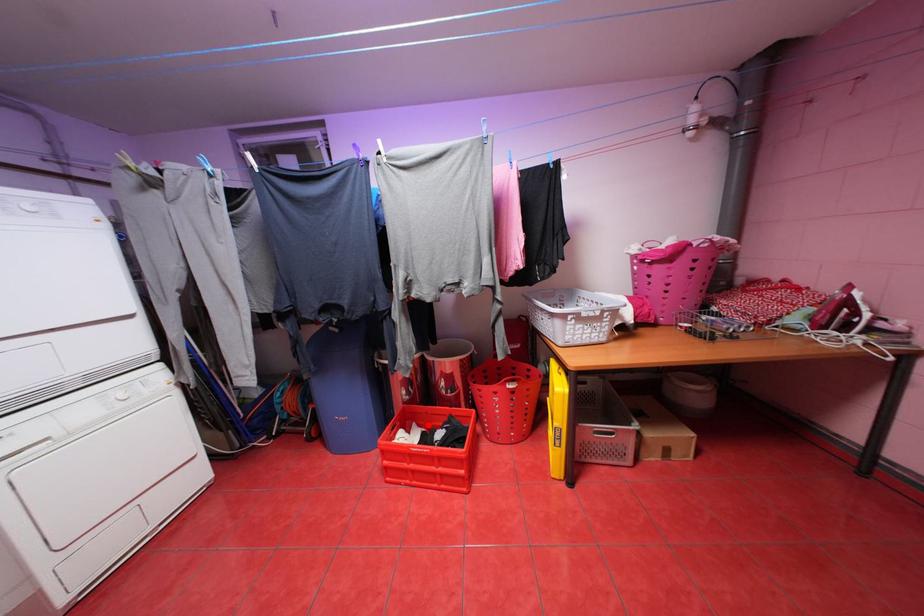
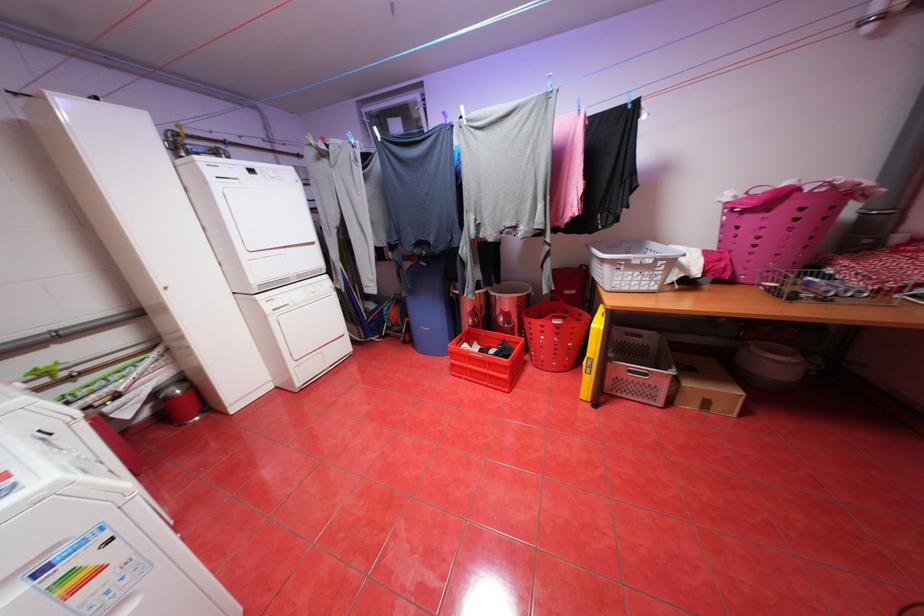
Question: I am providing you with two images of the same scene from different viewpoints. Given a red point in image1, look at the same physical point in image2. Is it:

Choices:
 (A) Closer to the viewpoint
 (B) Farther from the viewpoint

Answer: (A)